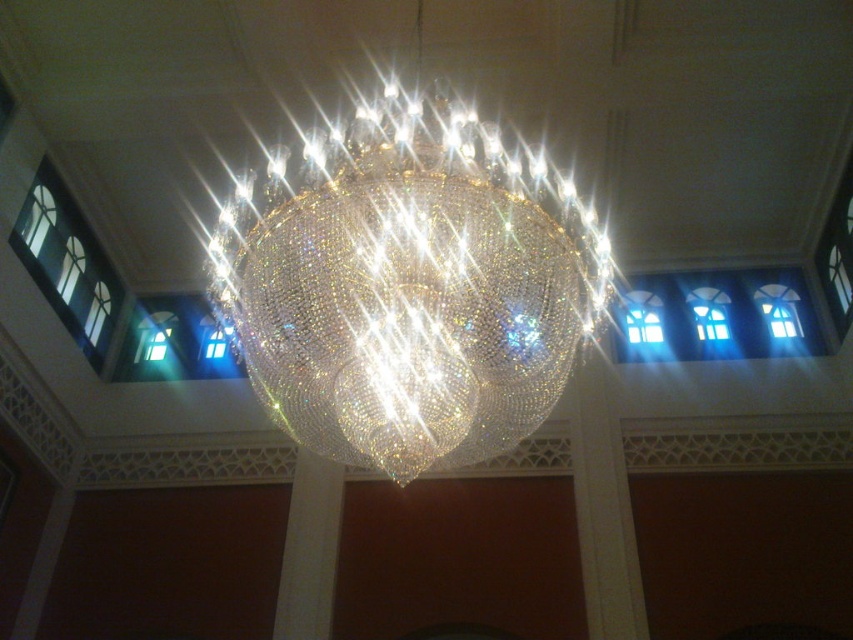
Does crystal glass chandelier at center have a lesser height compared to clear glass window at left?

No, crystal glass chandelier at center is not shorter than clear glass window at left.

What do you see at coordinates (412, 291) in the screenshot?
I see `crystal glass chandelier at center` at bounding box center [412, 291].

Is point (450, 442) closer to viewer compared to point (73, 300)?

Yes, point (450, 442) is in front of point (73, 300).

This screenshot has width=853, height=640. Find the location of `crystal glass chandelier at center`. crystal glass chandelier at center is located at coordinates point(412,291).

Consider the image. Which of these two, crystal glass chandelier at center or blue glass window at upper center, stands taller?

With more height is crystal glass chandelier at center.

Describe the element at coordinates (412, 291) in the screenshot. I see `crystal glass chandelier at center` at that location.

You are a GUI agent. You are given a task and a screenshot of the screen. Output one action in this format:
    pyautogui.click(x=<x>, y=<y>)
    Task: Click on the crystal glass chandelier at center
    The height and width of the screenshot is (640, 853).
    Given the screenshot: What is the action you would take?
    pyautogui.click(x=412, y=291)

The height and width of the screenshot is (640, 853). Describe the element at coordinates (717, 316) in the screenshot. I see `blue glass window at upper center` at that location.

Who is more forward, (762, 305) or (90, 337)?

Point (90, 337) is more forward.

The image size is (853, 640). I want to click on blue glass window at upper center, so click(x=717, y=316).

Find the location of a particular element. blue glass window at upper center is located at coordinates (717, 316).